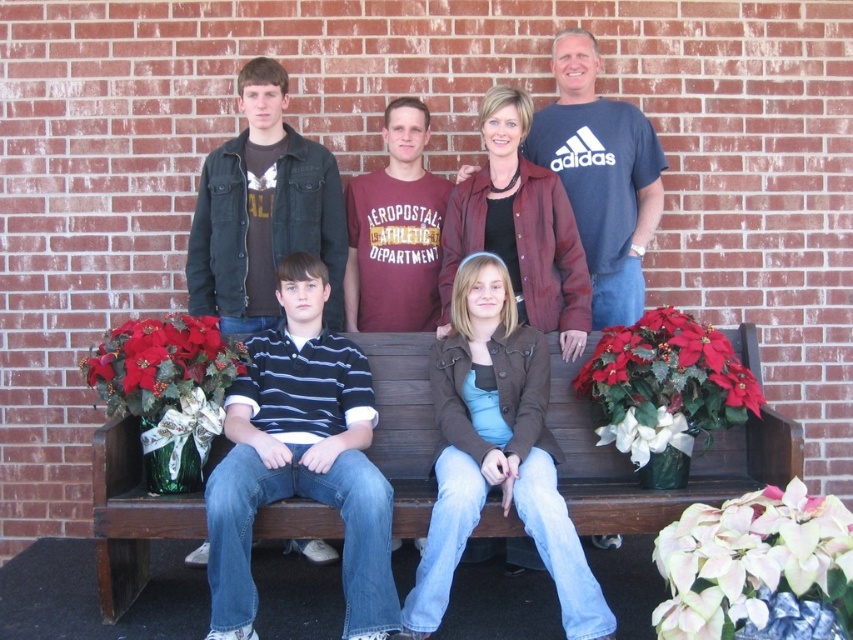
This screenshot has width=853, height=640. In order to click on blue striped polo shirt at center in this screenshot , I will do `click(300, 460)`.

Who is more forward, (318, 477) or (675, 408)?

Point (318, 477)

Measure the distance between blue striped polo shirt at center and camera.

blue striped polo shirt at center is 13.89 feet away from camera.

You are a GUI agent. You are given a task and a screenshot of the screen. Output one action in this format:
    pyautogui.click(x=<x>, y=<y>)
    Task: Click on the blue striped polo shirt at center
    
    Given the screenshot: What is the action you would take?
    pyautogui.click(x=300, y=460)

Can you confirm if pink paper-like petals at lower right is taller than silky red poinsettia at left?

Indeed, pink paper-like petals at lower right has a greater height compared to silky red poinsettia at left.

Can you confirm if pink paper-like petals at lower right is thinner than silky red poinsettia at left?

Indeed, pink paper-like petals at lower right has a lesser width compared to silky red poinsettia at left.

At what (x,y) coordinates should I click in order to perform the action: click on pink paper-like petals at lower right. Please return your answer as a coordinate pair (x, y). Looking at the image, I should click on (757, 568).

Find the location of a particular element. pink paper-like petals at lower right is located at coordinates (757, 568).

Describe the element at coordinates (300, 460) in the screenshot. I see `blue striped polo shirt at center` at that location.

Who is more forward, (x=263, y=442) or (x=252, y=193)?

Positioned in front is point (x=263, y=442).

Identify the location of blue striped polo shirt at center. The width and height of the screenshot is (853, 640). (300, 460).

At what (x,y) coordinates should I click in order to perform the action: click on blue striped polo shirt at center. Please return your answer as a coordinate pair (x, y). Looking at the image, I should click on (300, 460).